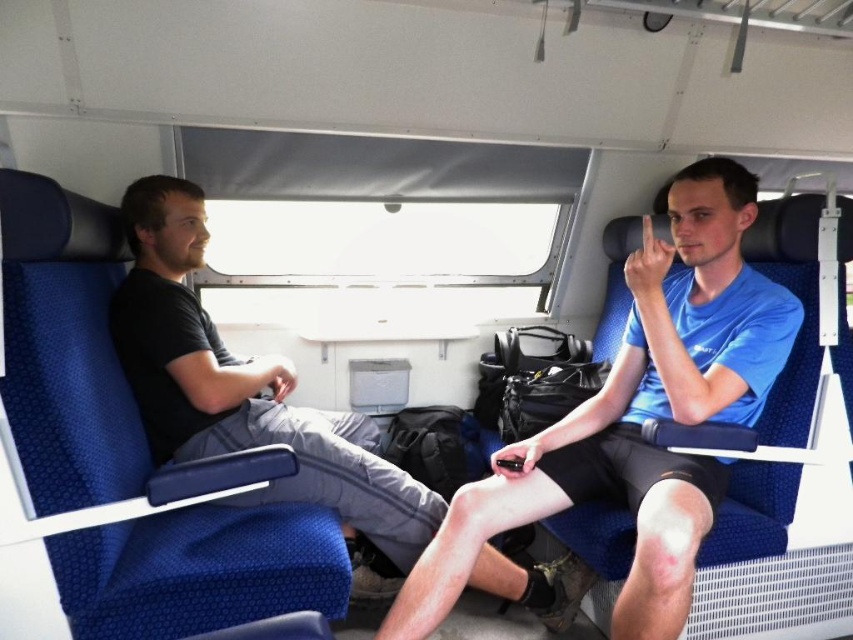
You are a tailor who needs to determine which shirt, the blue matte shirt at right or the black cotton shirt at left, requires more fabric for alterations. Based on their sizes, which one would need more material?

The black cotton shirt at left requires more fabric for alterations since it is larger than the blue matte shirt at right.

You are sitting in the train carriage and want to wave to someone outside through the window. Which person, the blue matte shirt at right or the black cotton shirt at left, has a better chance of being seen by someone outside the train?

The blue matte shirt at right has a better chance of being seen by someone outside the train because they are positioned in front of the black cotton shirt at left, making them closer to the window.

You are a passenger on a train and you see two people sitting across from you. One is wearing a blue matte shirt at right and the other is wearing a black cotton shirt at left. Which shirt is located to the right of the other?

The blue matte shirt at right is positioned on the right side of the black cotton shirt at left.